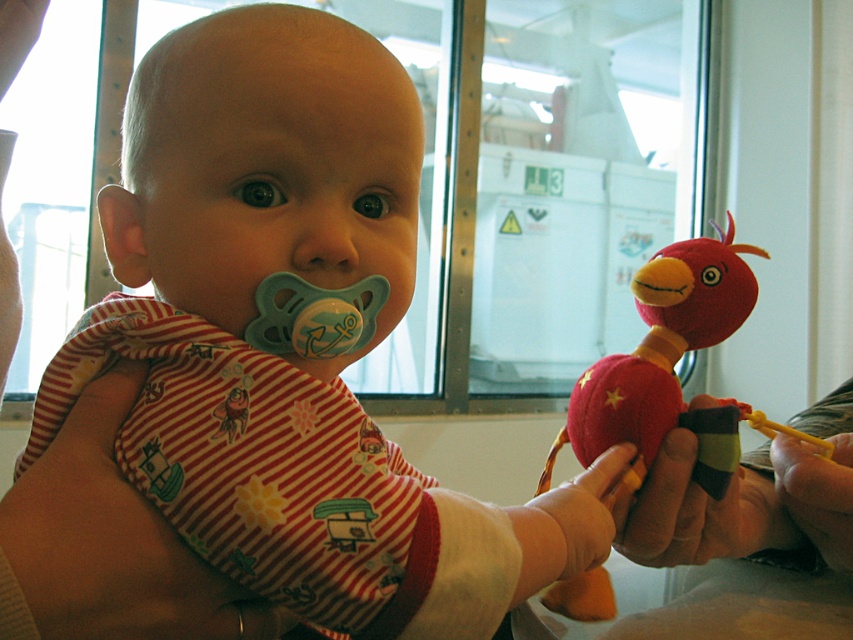
Who is positioned more to the right, matte plastic pacifier at center or fuzzy fabric bird at right?

From the viewer's perspective, fuzzy fabric bird at right appears more on the right side.

This screenshot has width=853, height=640. Describe the element at coordinates (271, 164) in the screenshot. I see `matte plastic pacifier at center` at that location.

Between point (229, 140) and point (732, 234), which one is positioned in front?

Point (229, 140)

Identify the location of matte plastic pacifier at center. (271, 164).